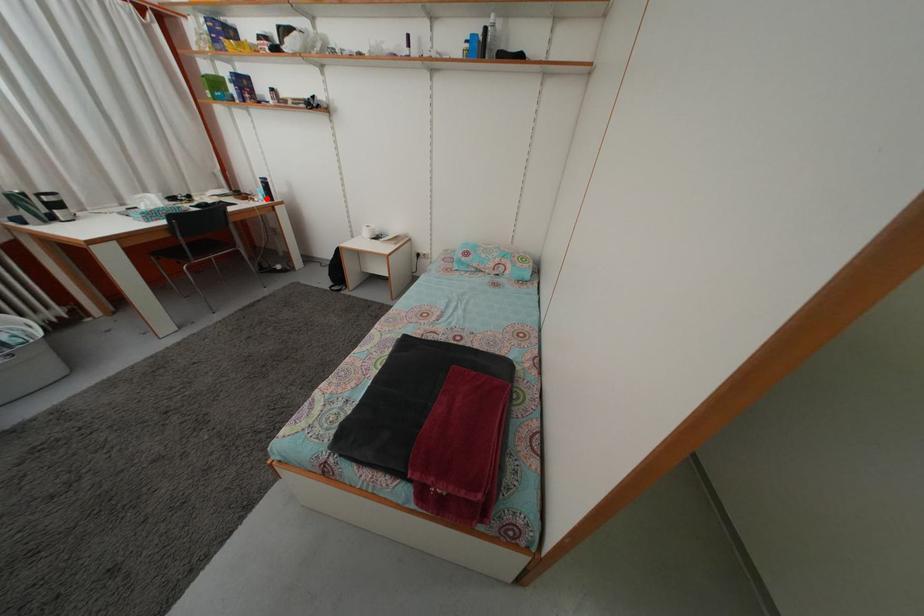
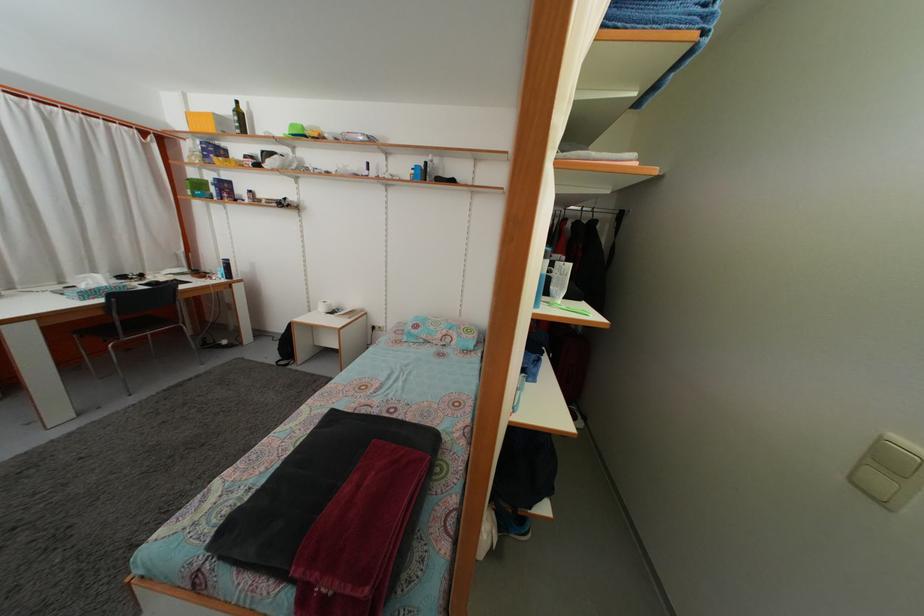
Question: I am providing you with two images of the same scene from different viewpoints. A red point is marked on the first image. At the location where the point appears in image 1, is it still visible in image 2?

Choices:
 (A) Yes
 (B) No

Answer: (A)